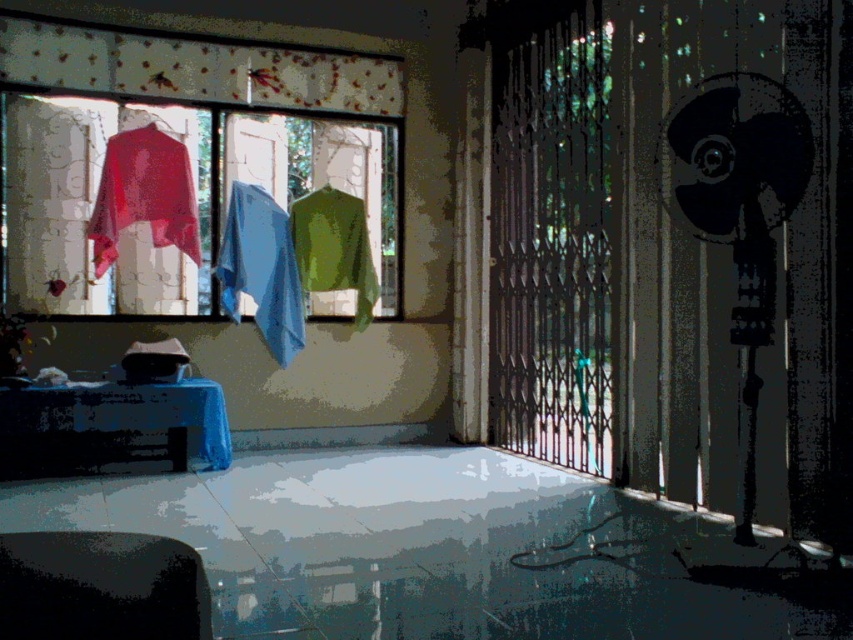
Between matte red sweater at left and green fabric hanger at upper center, which one has more height?

matte red sweater at left is taller.

Can you confirm if matte red sweater at left is smaller than green fabric hanger at upper center?

Actually, matte red sweater at left might be larger than green fabric hanger at upper center.

Locate an element on the screen. This screenshot has width=853, height=640. matte red sweater at left is located at coordinates (144, 195).

Who is higher up, black metal screen door at center or blue fabric at center?

Positioned higher is black metal screen door at center.

Can you confirm if black metal screen door at center is positioned to the left of blue fabric at center?

No, black metal screen door at center is not to the left of blue fabric at center.

Does point (492, 24) come closer to viewer compared to point (283, 292)?

No.

Where is `black metal screen door at center`? The image size is (853, 640). black metal screen door at center is located at coordinates (550, 232).

Does matte red sweater at left appear over green matte shirt at center?

Yes, matte red sweater at left is above green matte shirt at center.

In the scene shown: Can you confirm if matte red sweater at left is thinner than green matte shirt at center?

No, matte red sweater at left is not thinner than green matte shirt at center.

Locate an element on the screen. The height and width of the screenshot is (640, 853). matte red sweater at left is located at coordinates (144, 195).